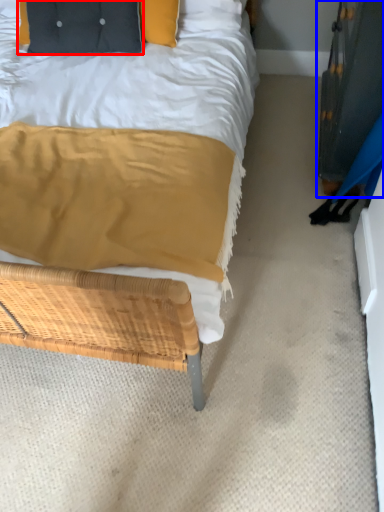
Question: Which object is closer to the camera taking this photo, pillow (highlighted by a red box) or dresser (highlighted by a blue box)?

Choices:
 (A) pillow
 (B) dresser

Answer: (B)